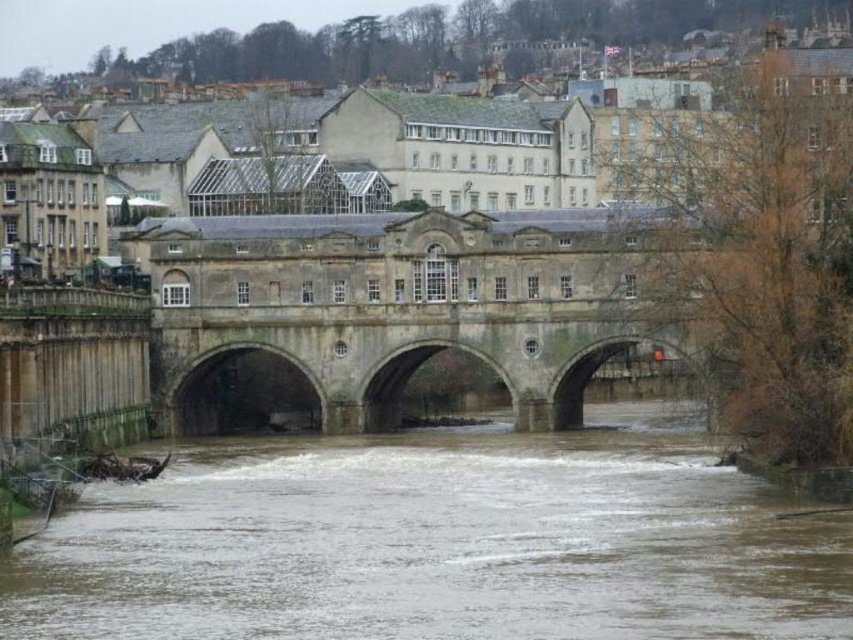
You are standing on the historic stone bridge and want to determine which of the two points, point (822, 536) or point (177, 426), is closer to you. Which point is nearer?

Point (822, 536) is closer to the viewer than point (177, 426).

You are standing on the historic stone bridge and want to know the distance between you and the brown muddy water at center. Can you estimate how far you are from it?

The brown muddy water at center and viewer are 66.35 meters apart from each other, so you are approximately 66.35 meters away from the brown muddy water at center.

You are a tourist standing on the stone bridge at center and looking down at the brown muddy water at center. Which one is closer to the ground level?

The brown muddy water at center is closer to the ground level than the stone bridge at center because it is shorter than the stone bridge at center.